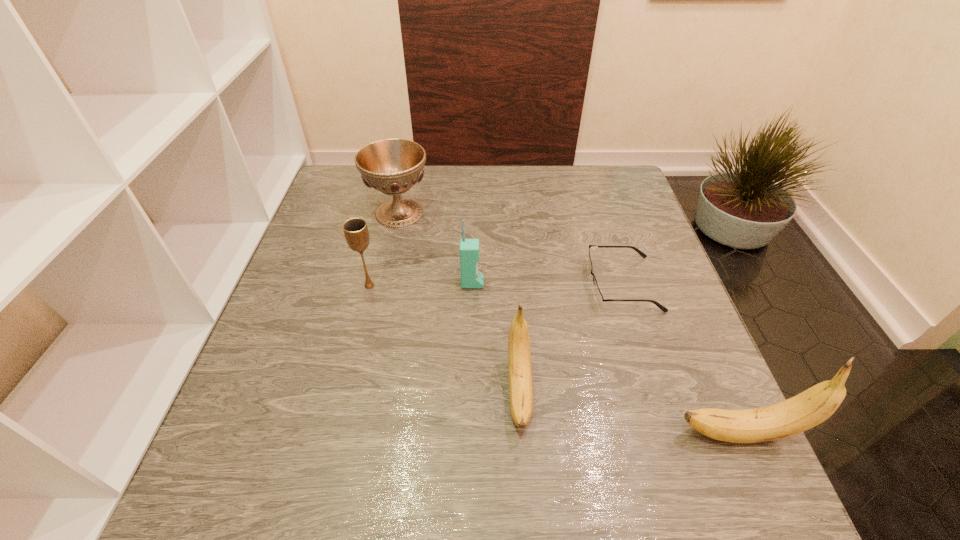
In order to click on object identified as the closest to the cellular telephone in this screenshot , I will do `click(519, 352)`.

At what (x,y) coordinates should I click in order to perform the action: click on blank area in the image that satisfies the following two spatial constraints: 1. on the keypad of the fourth object from right to left; 2. on the front side of the nearer chalice. Please return your answer as a coordinate pair (x, y). Looking at the image, I should click on coord(472,286).

Image resolution: width=960 pixels, height=540 pixels. In order to click on free space that satisfies the following two spatial constraints: 1. on the front-facing side of the shortest object; 2. on the front side of the nearer chalice in this screenshot , I will do `click(623, 286)`.